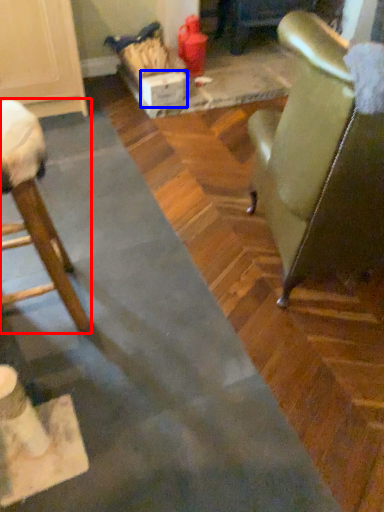
Question: Among these objects, which one is nearest to the camera, chair (highlighted by a red box) or cardboard box (highlighted by a blue box)?

Choices:
 (A) chair
 (B) cardboard box

Answer: (A)